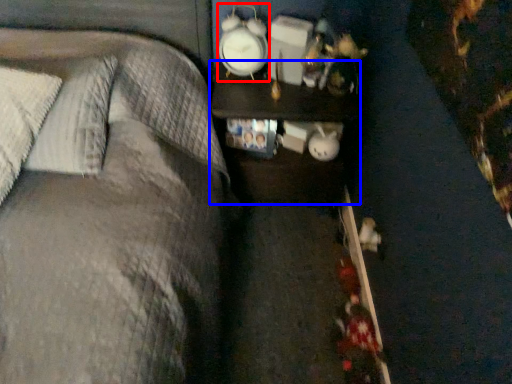
Question: Among these objects, which one is farthest to the camera, clock (highlighted by a red box) or nightstand (highlighted by a blue box)?

Choices:
 (A) clock
 (B) nightstand

Answer: (B)